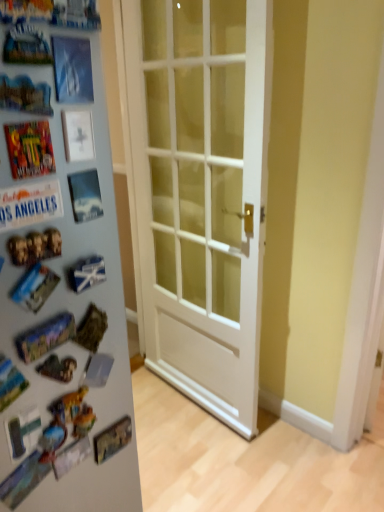
Locate an element on the screen. This screenshot has height=512, width=384. free spot in front of white glossy door at center is located at coordinates (221, 494).